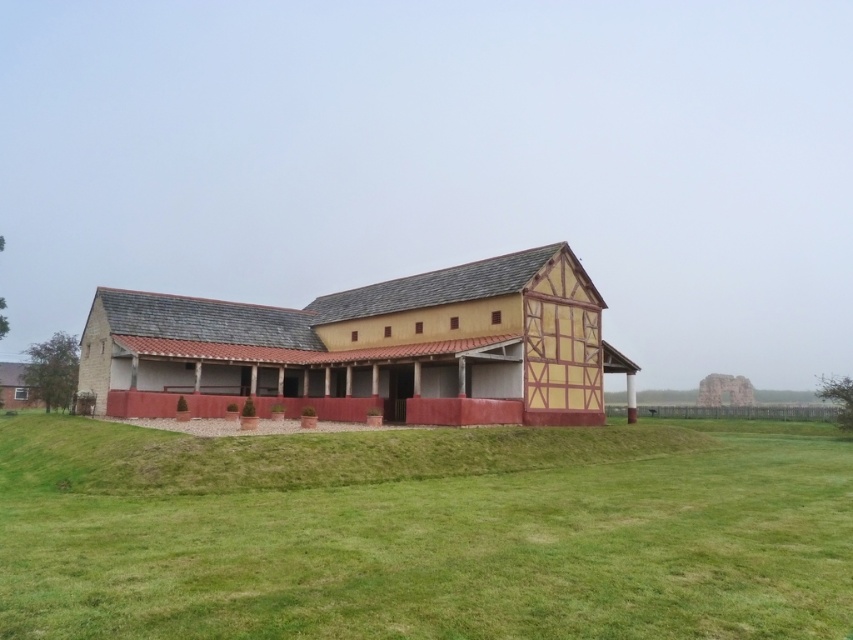
Does green grass at center appear under wooden barn at center?

Correct, green grass at center is located below wooden barn at center.

Is point (474, 440) in front of point (479, 305)?

Yes, it is.

Find the location of a particular element. The height and width of the screenshot is (640, 853). green grass at center is located at coordinates (424, 532).